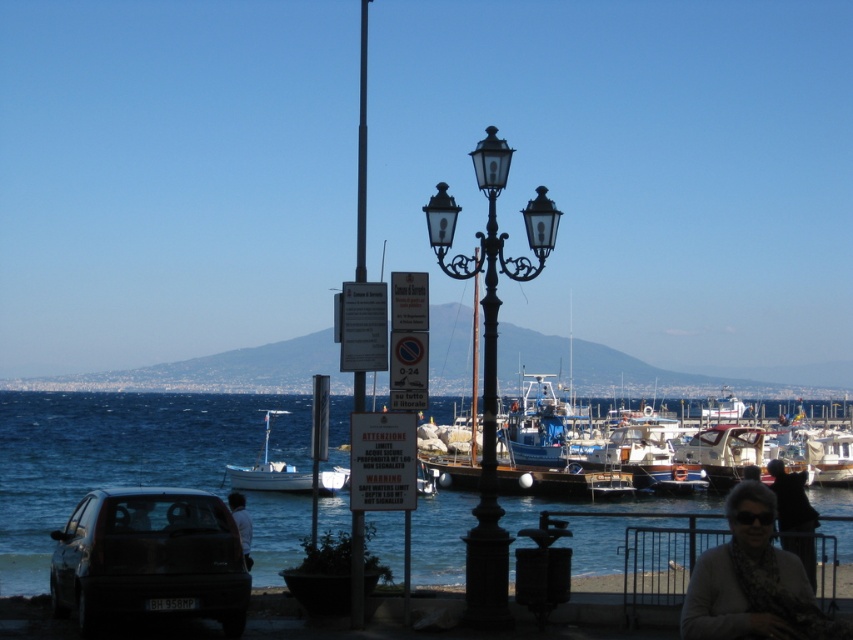
Question: Which point is farther to the camera?

Choices:
 (A) black fur cat at lower right
 (B) dark gray matte car at lower left
 (C) white matte boat at center

Answer: (C)

Question: Does blue water at lower center have a greater width compared to white knit sweater at lower right?

Choices:
 (A) yes
 (B) no

Answer: (A)

Question: Considering the real-world distances, which object is farthest from the black wrought iron streetlight at center?

Choices:
 (A) black fur cat at lower right
 (B) white knit sweater at lower right

Answer: (B)

Question: Is blue water at lower center positioned in front of dark gray fabric jacket at lower center?

Choices:
 (A) yes
 (B) no

Answer: (A)

Question: Which point is farther to the camera?

Choices:
 (A) (200, 472)
 (B) (341, 468)
 (C) (241, 536)
 (D) (798, 515)

Answer: (A)

Question: Does dark gray matte car at lower left appear on the right side of white knit sweater at lower right?

Choices:
 (A) yes
 (B) no

Answer: (B)